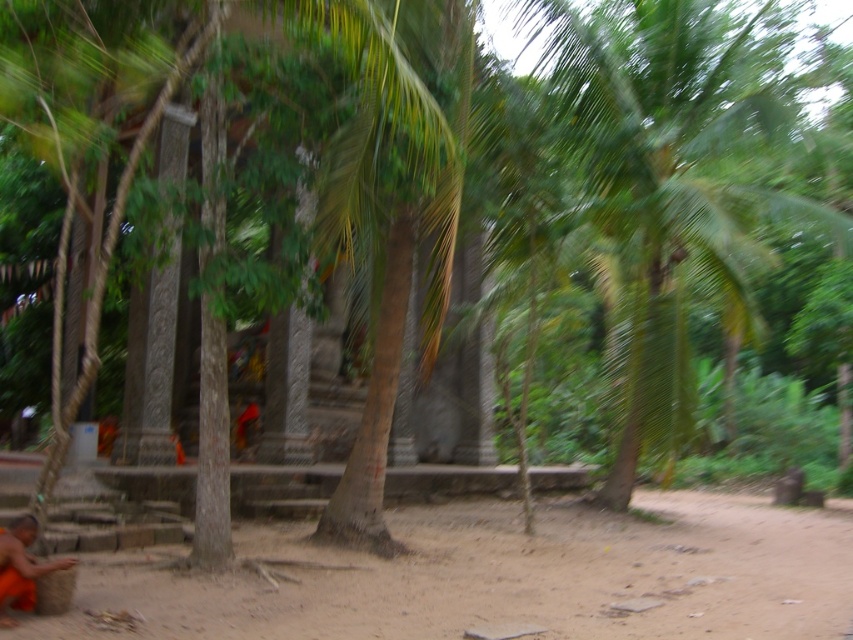
Is green leafy palm tree at right closer to the viewer compared to orange cloth at lower left?

No.

Who is more forward, (x=648, y=406) or (x=4, y=584)?

Positioned in front is point (x=4, y=584).

The height and width of the screenshot is (640, 853). What are the coordinates of `green leafy palm tree at right` in the screenshot? It's located at (675, 176).

Between brown sandy dirt at lower center and orange cloth at lower left, which one is positioned higher?

Positioned higher is orange cloth at lower left.

The height and width of the screenshot is (640, 853). In order to click on brown sandy dirt at lower center in this screenshot , I will do `click(503, 577)`.

Where is `brown sandy dirt at lower center`? This screenshot has height=640, width=853. brown sandy dirt at lower center is located at coordinates (503, 577).

Does brown sandy dirt at lower center come in front of green leafy palm tree at right?

Yes.

Is brown sandy dirt at lower center below green leafy palm tree at right?

Yes, brown sandy dirt at lower center is below green leafy palm tree at right.

Does point (608, 540) lie behind point (651, 442)?

That is False.

Locate an element on the screen. Image resolution: width=853 pixels, height=640 pixels. brown sandy dirt at lower center is located at coordinates (503, 577).